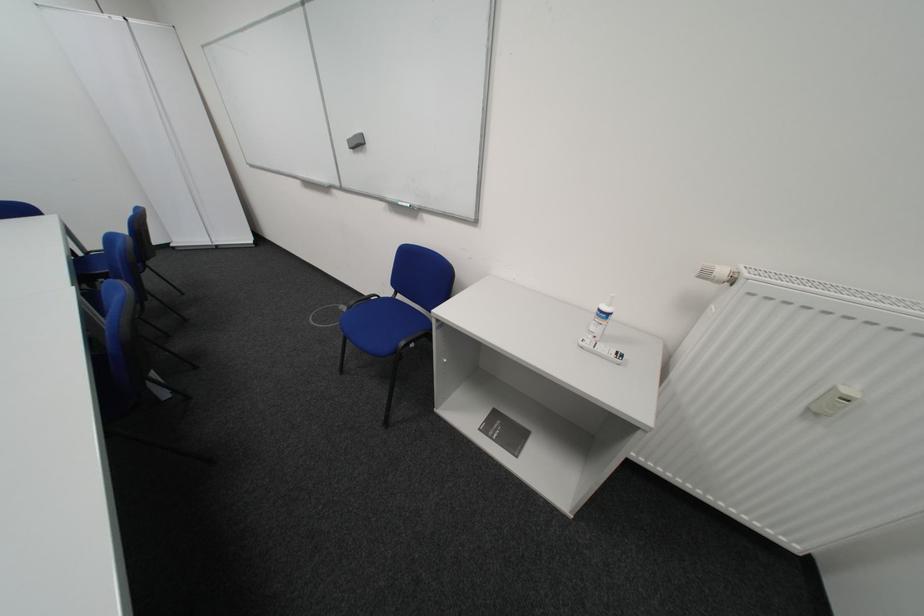
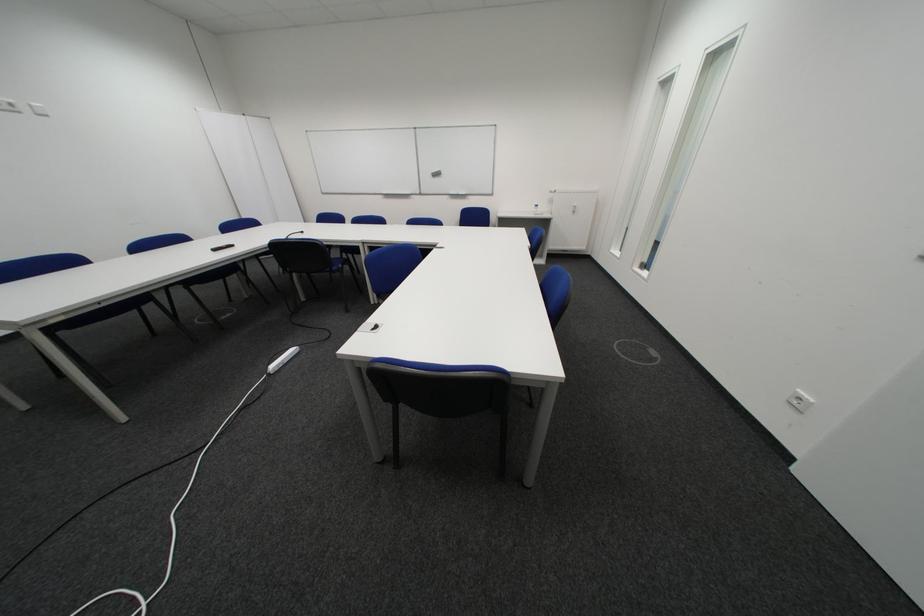
Question: I am providing you with two images of the same scene from different viewpoints. After the viewpoint changes to image2, which objects are now occluded?

Choices:
 (A) black microphone
 (B) white wall outlet
 (C) blue chair sitting surface
 (D) shower holder adjuster

Answer: (C)